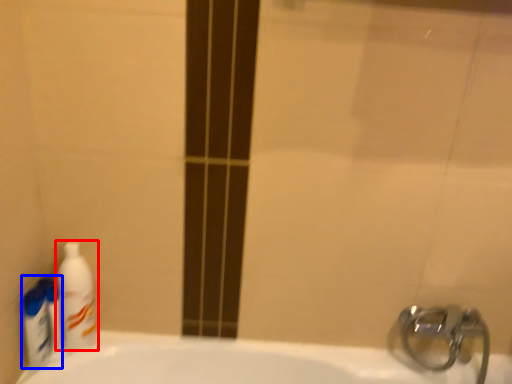
Question: Which object appears farthest to the camera in this image, cleaning product (highlighted by a red box) or cleaning product (highlighted by a blue box)?

Choices:
 (A) cleaning product
 (B) cleaning product

Answer: (A)